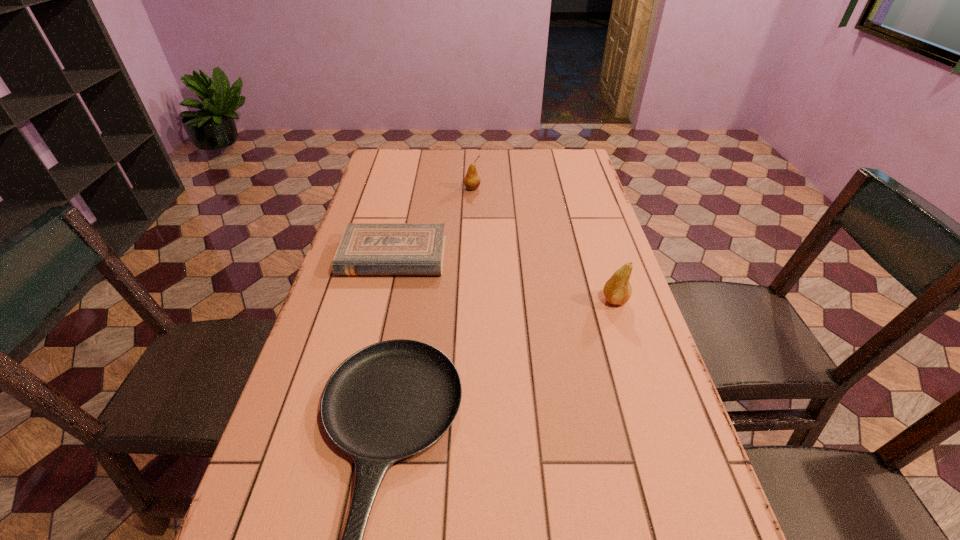
Identify which object is the third nearest to the nearer pear. Please provide its 2D coordinates. Your answer should be formatted as a tuple, i.e. [(x, y)], where the tuple contains the x and y coordinates of a point satisfying the conditions above.

[(472, 181)]